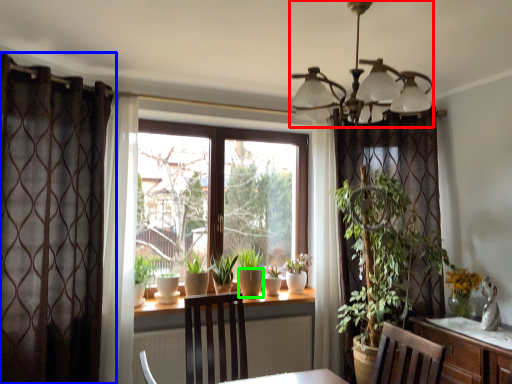
Question: Considering the real-world distances, which object is closest to light fixture (highlighted by a red box)? curtain (highlighted by a blue box) or flowerpot (highlighted by a green box).

Choices:
 (A) curtain
 (B) flowerpot

Answer: (A)